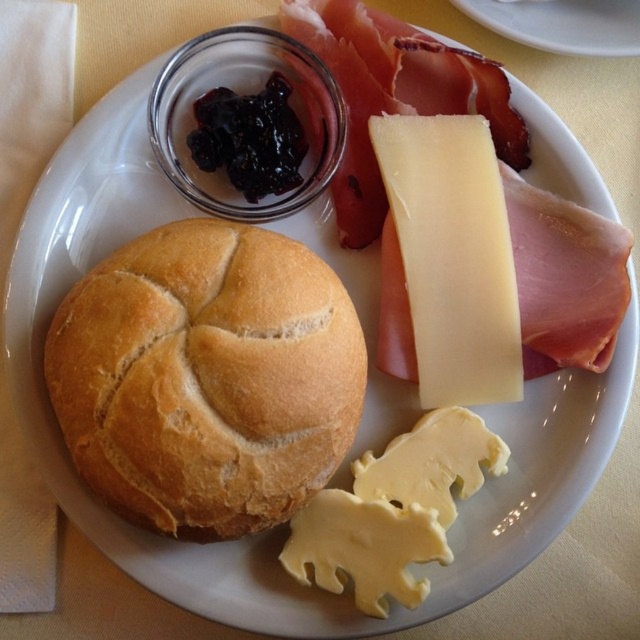
Question: Does golden brown crusty loaf at center have a lesser width compared to white smooth cheese at upper right?

Choices:
 (A) no
 (B) yes

Answer: (A)

Question: Which point is closer to the camera?

Choices:
 (A) (461, 266)
 (B) (292, 460)
 (C) (333, 536)

Answer: (B)

Question: Can you confirm if golden brown crusty loaf at center is positioned to the left of white smooth cheese at upper right?

Choices:
 (A) yes
 (B) no

Answer: (A)

Question: Which of these objects is positioned closest to the yellowish smooth cheese at lower center?

Choices:
 (A) golden brown crusty loaf at center
 (B) white smooth cheese at upper right

Answer: (B)

Question: Can you confirm if golden brown crusty loaf at center is positioned above yellowish smooth cheese at lower center?

Choices:
 (A) no
 (B) yes

Answer: (B)

Question: Which of these objects is positioned closest to the golden brown crusty loaf at center?

Choices:
 (A) white smooth cheese at upper right
 (B) yellowish smooth cheese at lower center

Answer: (B)